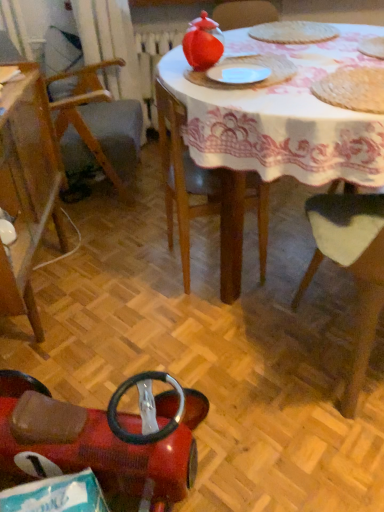
I want to click on vacant area that is situated to the right of matte glass tea pot at upper center, so click(264, 65).